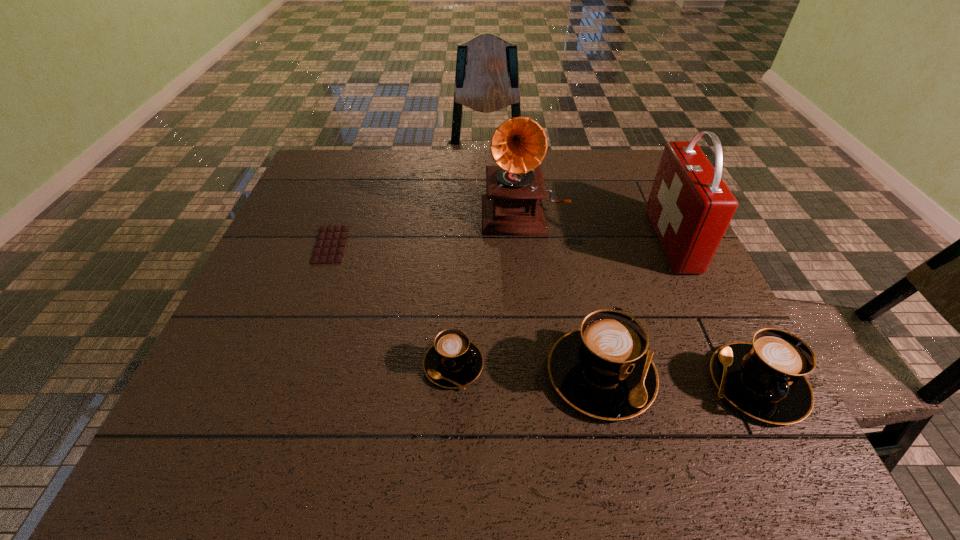
Where is `the first-aid kit at the right edge`? This screenshot has height=540, width=960. the first-aid kit at the right edge is located at coordinates point(690,207).

Where is `object present at the near right corner`? object present at the near right corner is located at coordinates (765, 379).

What are the coordinates of `vacant space at the far edge of the desktop` in the screenshot? It's located at (373, 159).

Locate an element on the screen. Image resolution: width=960 pixels, height=540 pixels. free space at the near edge of the desktop is located at coordinates (297, 390).

Identify the location of vacant space at the left edge of the desktop. (300, 303).

In the image, there is a desktop. Where is `vacant space at the right edge`? The image size is (960, 540). vacant space at the right edge is located at coordinates (654, 266).

At what (x,y) coordinates should I click in order to perform the action: click on free space at the far left corner of the desktop. Please return your answer as a coordinate pair (x, y). Looking at the image, I should click on (345, 160).

This screenshot has width=960, height=540. Identify the location of vacant position at the far right corner of the desktop. (616, 151).

This screenshot has width=960, height=540. In order to click on free space between the phonograph record and the leftmost object in this screenshot , I will do `click(428, 228)`.

You are a GUI agent. You are given a task and a screenshot of the screen. Output one action in this format:
    pyautogui.click(x=<x>, y=<y>)
    Task: Click on the free point between the leftmost cappuccino and the phonograph record
    
    Given the screenshot: What is the action you would take?
    pyautogui.click(x=489, y=288)